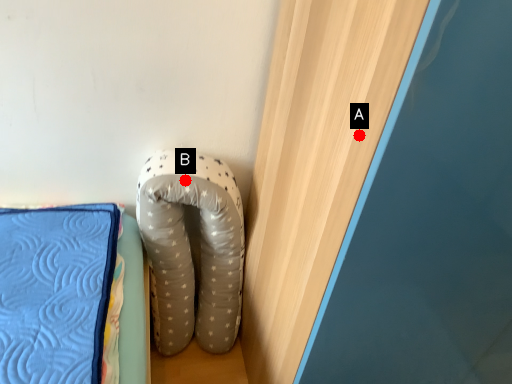
Question: Two points are circled on the image, labeled by A and B beside each circle. Among these points, which one is nearest to the camera?

Choices:
 (A) A is closer
 (B) B is closer

Answer: (A)